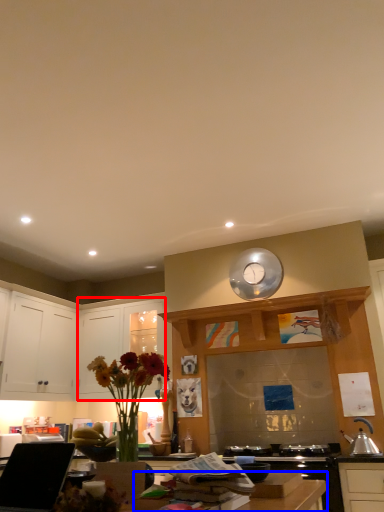
Question: Which object appears farthest to the camera in this image, cabinetry (highlighted by a red box) or counter top (highlighted by a blue box)?

Choices:
 (A) cabinetry
 (B) counter top

Answer: (A)